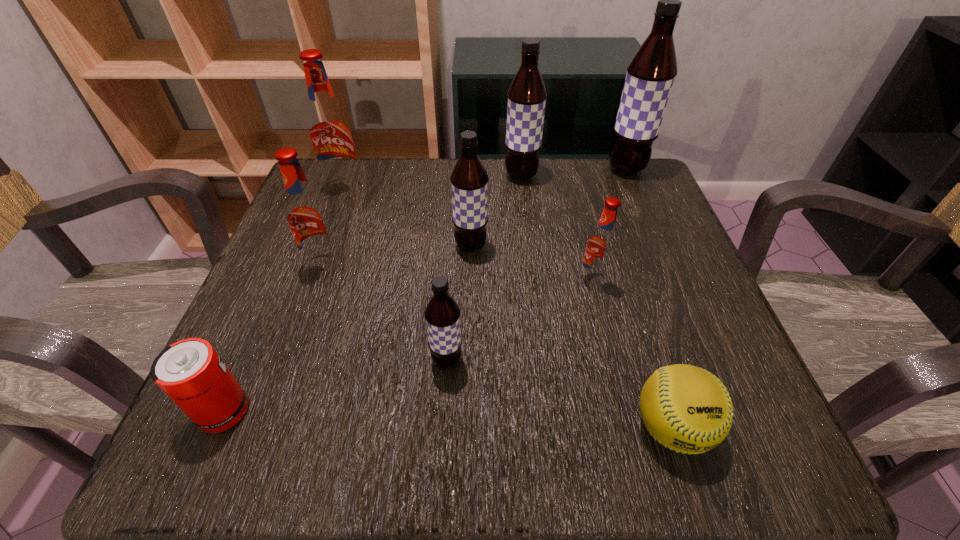
Where is `object at the near right corner`? object at the near right corner is located at coordinates (687, 409).

In the image, there is a desktop. Where is `vacant space at the far edge`? Image resolution: width=960 pixels, height=540 pixels. vacant space at the far edge is located at coordinates (575, 180).

In the image, there is a desktop. At what (x,y) coordinates should I click in order to perform the action: click on free space at the near edge. Please return your answer as a coordinate pair (x, y). This screenshot has height=540, width=960. Looking at the image, I should click on tap(554, 465).

Image resolution: width=960 pixels, height=540 pixels. In the image, there is a desktop. What are the coordinates of `vacant space at the left edge` in the screenshot? It's located at (357, 240).

This screenshot has width=960, height=540. I want to click on free location at the far left corner, so click(x=339, y=215).

The height and width of the screenshot is (540, 960). In the image, there is a desktop. Identify the location of vacant space at the far right corner. (624, 199).

Where is `free space that is in between the seventh farthest object and the second smallest red root beer`? The width and height of the screenshot is (960, 540). free space that is in between the seventh farthest object and the second smallest red root beer is located at coordinates (385, 313).

Where is `free space between the softball and the second smallest red root beer`? The width and height of the screenshot is (960, 540). free space between the softball and the second smallest red root beer is located at coordinates (497, 346).

You are a GUI agent. You are given a task and a screenshot of the screen. Output one action in this format:
    pyautogui.click(x=<x>, y=<y>)
    Task: Click on the blank region between the shortest object and the farthest red root beer
    The width and height of the screenshot is (960, 540).
    Given the screenshot: What is the action you would take?
    pyautogui.click(x=509, y=308)

Locate an element on the screen. This screenshot has width=960, height=540. vacant area that lies between the second smallest red root beer and the sixth object from left to right is located at coordinates tap(422, 220).